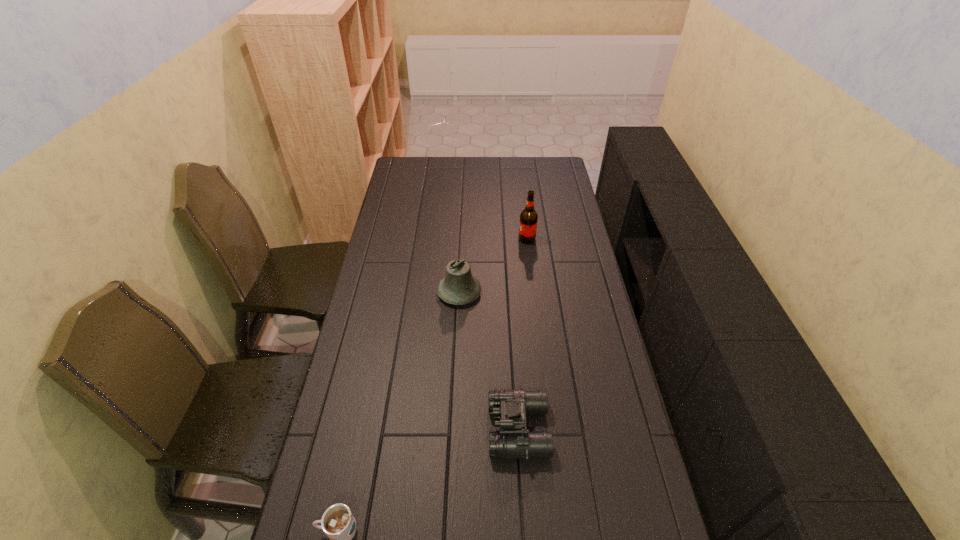
Locate an element on the screen. object that stands as the second closest to the third nearest object is located at coordinates (509, 407).

Identify which object is the second closest to the farthest object. Please provide its 2D coordinates. Your answer should be formatted as a tuple, i.e. [(x, y)], where the tuple contains the x and y coordinates of a point satisfying the conditions above.

[(509, 407)]